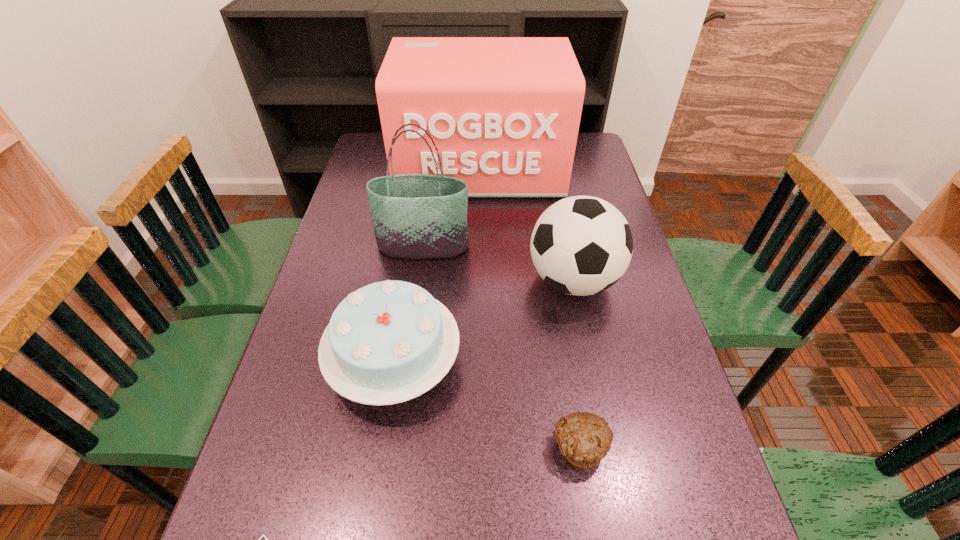
Identify the location of vacant position at the far right corner of the desktop. (579, 134).

Find the location of a particular element. This screenshot has width=960, height=540. free space between the tote bag and the fourth shortest object is located at coordinates (498, 264).

Identify the location of free space between the farthest object and the muffin. The height and width of the screenshot is (540, 960). (530, 308).

Identify the location of free spot between the third shortest object and the muffin. pyautogui.click(x=487, y=404).

Where is `empty space between the farthest object and the soccer ball`? The image size is (960, 540). empty space between the farthest object and the soccer ball is located at coordinates (527, 225).

Where is `blank region between the fifth tallest object and the fourth tallest object`? The height and width of the screenshot is (540, 960). blank region between the fifth tallest object and the fourth tallest object is located at coordinates pyautogui.click(x=487, y=404).

At what (x,y) coordinates should I click in order to perform the action: click on blank region between the muffin and the tote bag. Please return your answer as a coordinate pair (x, y). This screenshot has height=540, width=960. Looking at the image, I should click on (501, 347).

In order to click on unoccupied area between the soccer ball and the fifth tallest object in this screenshot , I will do `click(576, 363)`.

Locate an element on the screen. The width and height of the screenshot is (960, 540). the second closest object relative to the second shortest object is located at coordinates (581, 245).

Find the location of a particular element. Image resolution: width=960 pixels, height=540 pixels. object that ranks as the second closest to the calculator is located at coordinates (584, 439).